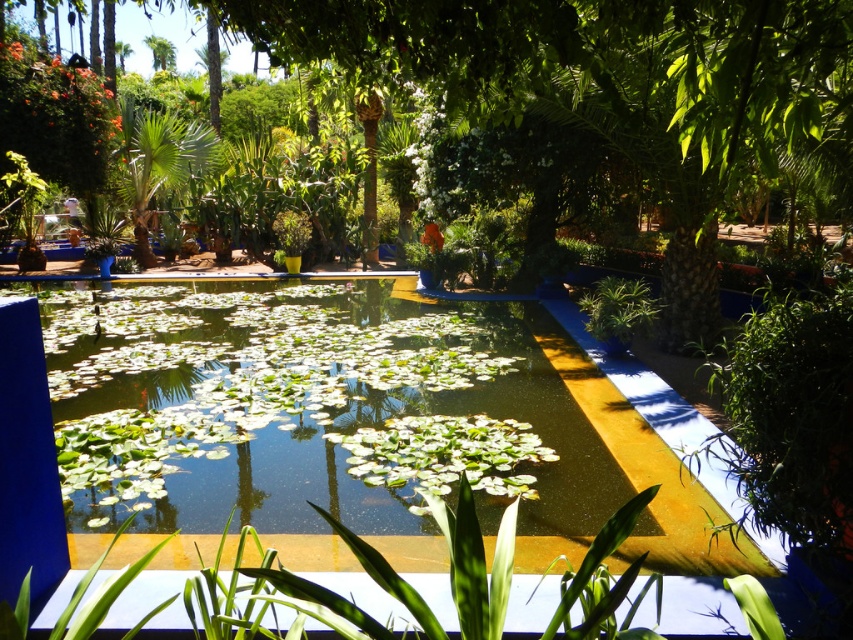
You are a gardener who wants to place a new statue in the garden. The statue requires a space that is larger than the green leafy tree at center. Can the green leafy pool at center accommodate the statue?

The green leafy pool at center has a larger size compared to the green leafy tree at center, so yes, the statue can be placed in the green leafy pool at center since it provides sufficient space.

You are standing in the garden looking at the pool. There are two points in the scene labeled as point 1 and point 2. Point 1 is at coordinates point (x=207, y=330) and point 2 is at point (x=723, y=124). Which point is closer to you?

Point 1 at coordinates point (x=207, y=330) is closer to you because it is further to the camera than point 2 at point (x=723, y=124).